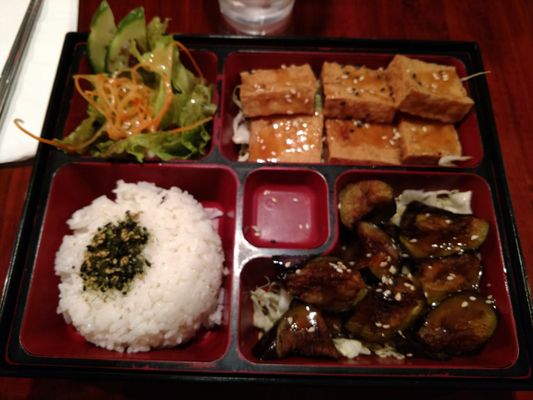
Image resolution: width=533 pixels, height=400 pixels. What are the coordinates of `utensil` in the screenshot? It's located at (19, 41).